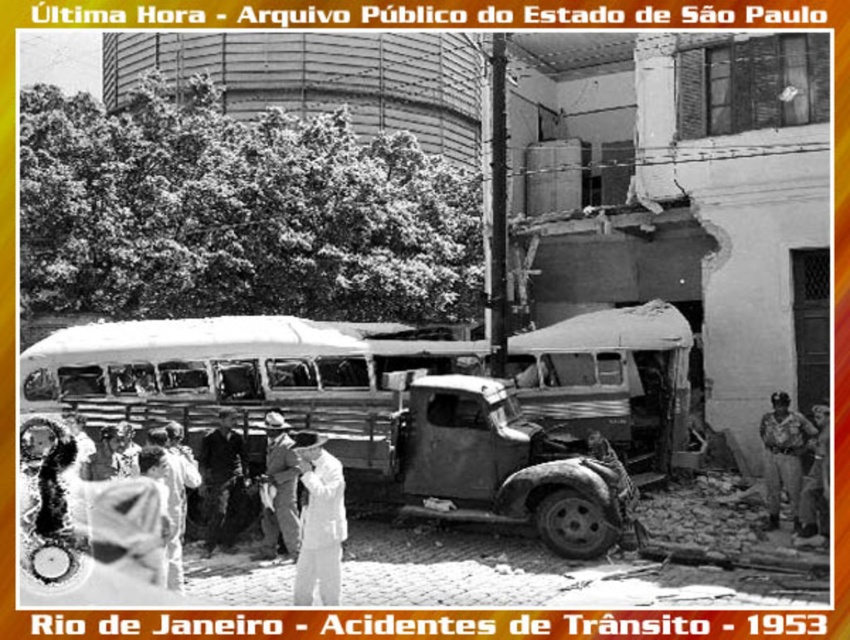
Measure the distance between rusty metal truck at center and light brown leather hat at center.

They are 2.16 meters apart.

Is point (476, 432) positioned behind point (284, 548)?

Yes, it is behind point (284, 548).

Where is `rusty metal truck at center`? rusty metal truck at center is located at coordinates (499, 461).

Who is more distant from viewer, [299,589] or [822,461]?

Point [822,461]

Is white clothed person at center above white cloth shirt at lower right?

Yes.

Find the location of a particular element. white clothed person at center is located at coordinates (319, 522).

Is rusty metal truck at center thinner than dark fabric coat at center?

No.

Can you confirm if rusty metal truck at center is shorter than dark fabric coat at center?

Incorrect, rusty metal truck at center's height does not fall short of dark fabric coat at center's.

Is point (552, 547) farther from viewer compared to point (233, 422)?

No.

Where is `rusty metal truck at center`? This screenshot has height=640, width=850. rusty metal truck at center is located at coordinates (499, 461).